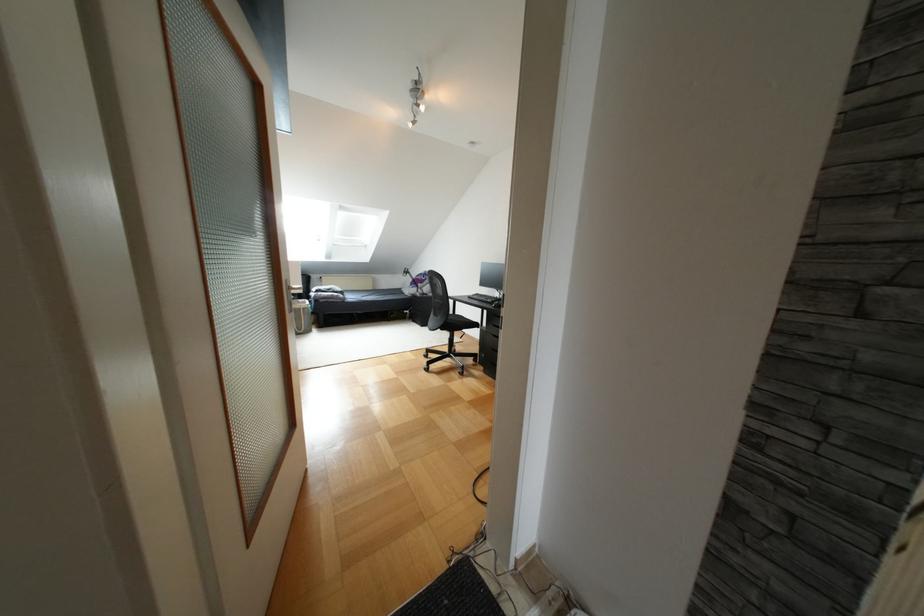
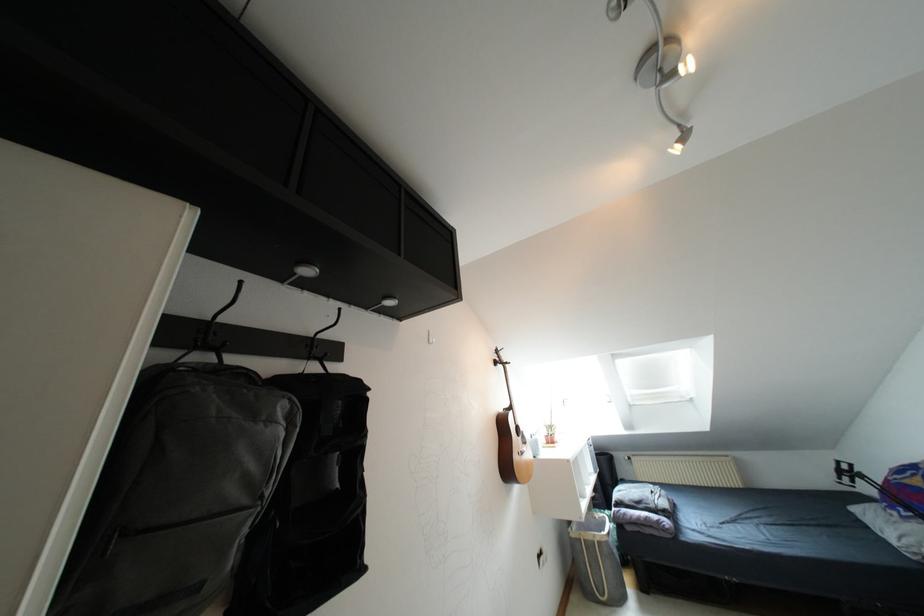
Where in the second image is the point corresponding to (x=412, y=122) from the first image?

(683, 138)